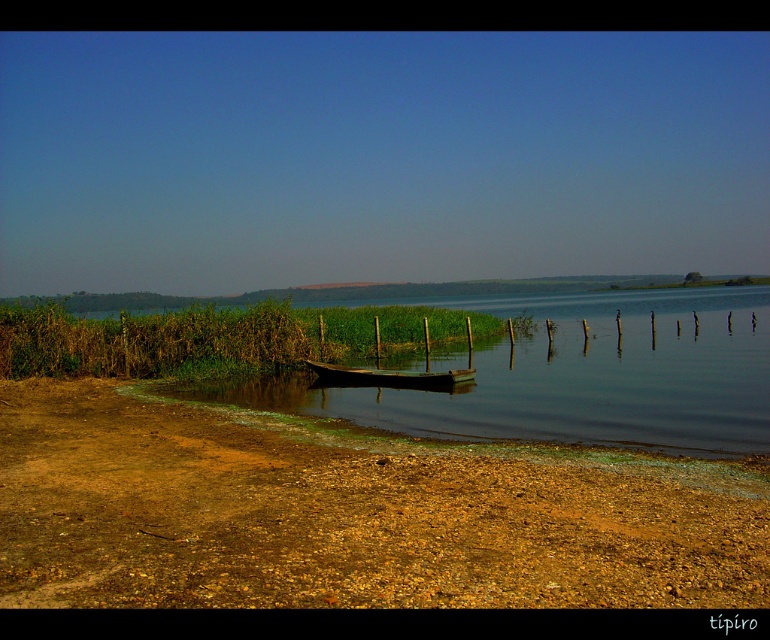
Question: Among these points, which one is nearest to the camera?

Choices:
 (A) (397, 387)
 (B) (457, 557)

Answer: (B)

Question: Which object appears farthest from the camera in this image?

Choices:
 (A) brown gravel shore at lower left
 (B) wooden boat at center

Answer: (B)

Question: Observing the image, what is the correct spatial positioning of brown gravel shore at lower left in reference to wooden boat at center?

Choices:
 (A) left
 (B) right

Answer: (A)

Question: Does brown gravel shore at lower left appear over wooden boat at center?

Choices:
 (A) no
 (B) yes

Answer: (A)

Question: Is brown gravel shore at lower left positioned at the back of wooden boat at center?

Choices:
 (A) yes
 (B) no

Answer: (B)

Question: Which point appears farthest from the camera in this image?

Choices:
 (A) (534, 460)
 (B) (427, 378)

Answer: (B)